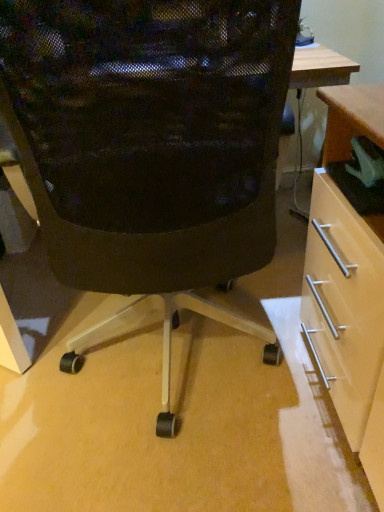
The height and width of the screenshot is (512, 384). Describe the element at coordinates (150, 147) in the screenshot. I see `black mesh chair at center` at that location.

The image size is (384, 512). In order to click on black mesh chair at center in this screenshot , I will do `click(150, 147)`.

This screenshot has width=384, height=512. I want to click on black mesh chair at center, so click(150, 147).